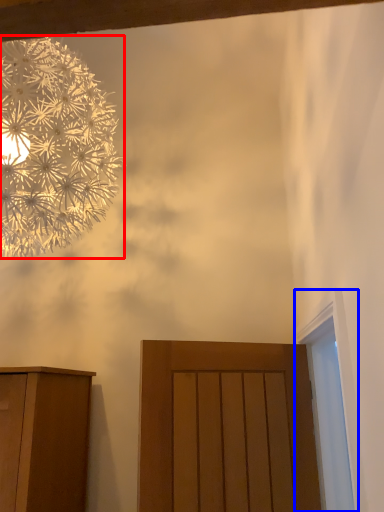
Question: Among these objects, which one is nearest to the camera, flower (highlighted by a red box) or window (highlighted by a blue box)?

Choices:
 (A) flower
 (B) window

Answer: (B)